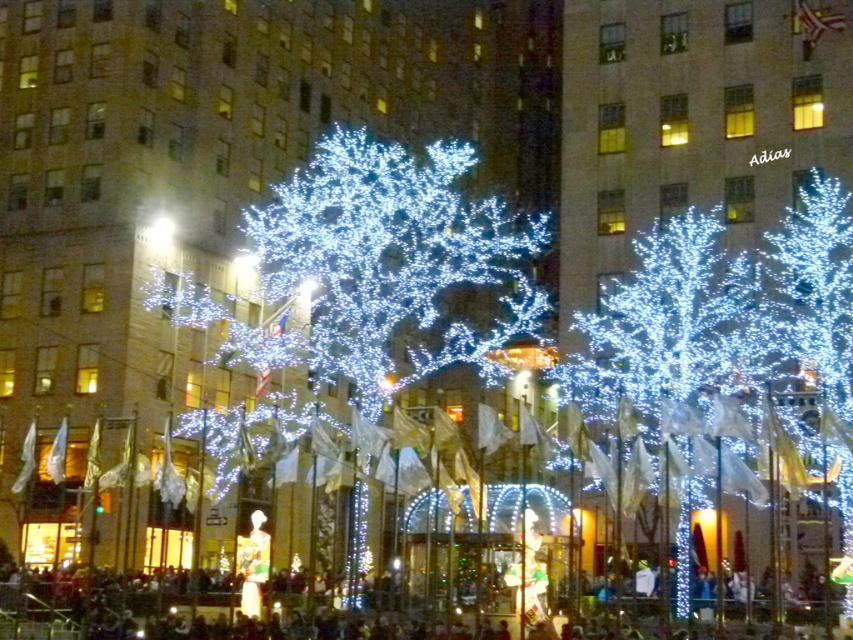
Question: Does illuminated white tree at center have a lesser width compared to illuminated plastic tree at right?

Choices:
 (A) yes
 (B) no

Answer: (B)

Question: Observing the image, what is the correct spatial positioning of illuminated white tree at center in reference to illuminated plastic tree at center?

Choices:
 (A) below
 (B) above

Answer: (B)

Question: Which object is positioned farthest from the illuminated plastic tree at center?

Choices:
 (A) illuminated plastic tree at right
 (B) illuminated white tree at center

Answer: (B)

Question: Based on their relative distances, which object is nearer to the illuminated plastic tree at right?

Choices:
 (A) illuminated plastic tree at center
 (B) illuminated white tree at center

Answer: (A)

Question: Is illuminated white tree at center to the left of illuminated plastic tree at right from the viewer's perspective?

Choices:
 (A) yes
 (B) no

Answer: (A)

Question: Which point is closer to the camera taking this photo?

Choices:
 (A) (207, 301)
 (B) (643, 346)
 (C) (788, 300)

Answer: (C)